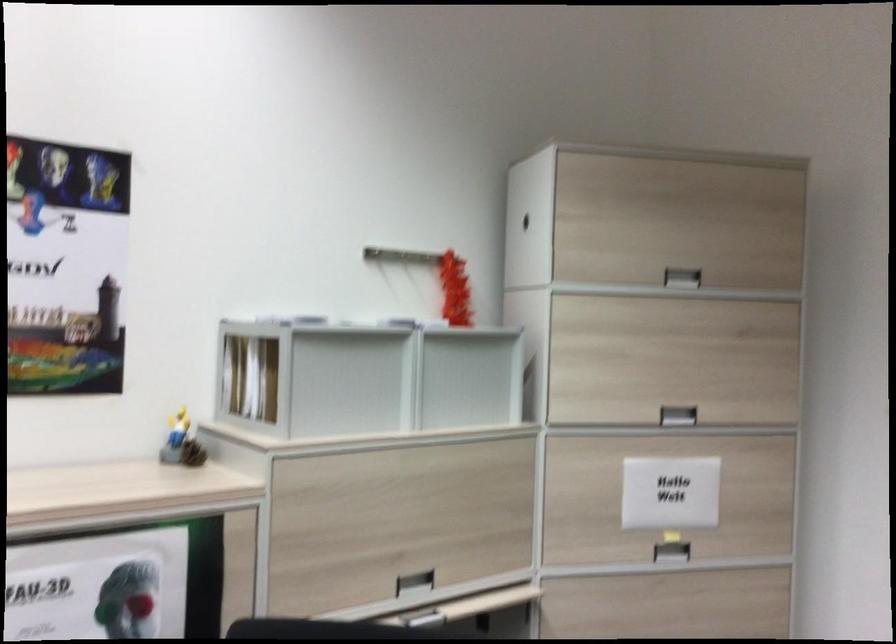
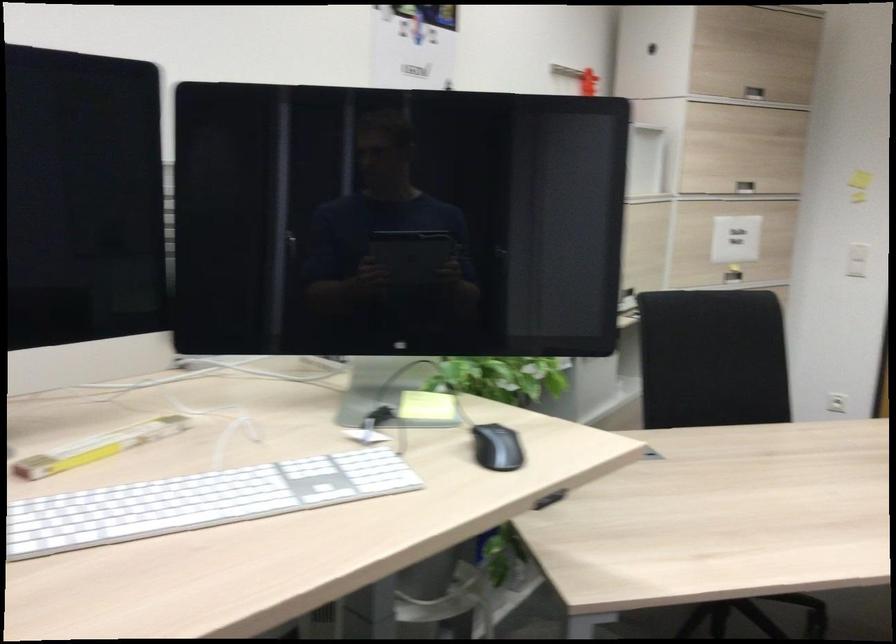
The point at (670, 281) is marked in the first image. Where is the corresponding point in the second image?

(754, 93)